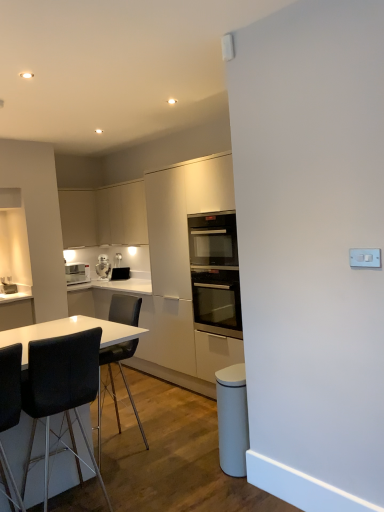
Question: From a real-world perspective, does black glass oven at center sit lower than black fabric chair at lower left, acting as the third chair starting from the front?

Choices:
 (A) yes
 (B) no

Answer: (B)

Question: Can you confirm if black glass oven at center is positioned to the right of black fabric chair at lower left, acting as the third chair starting from the front?

Choices:
 (A) no
 (B) yes

Answer: (B)

Question: Considering the relative positions of black glass oven at center and black fabric chair at lower left, acting as the third chair starting from the front, in the image provided, is black glass oven at center to the left of black fabric chair at lower left, acting as the third chair starting from the front, from the viewer's perspective?

Choices:
 (A) yes
 (B) no

Answer: (B)

Question: Is black glass oven at center completely or partially outside of black fabric chair at lower left, acting as the third chair starting from the front?

Choices:
 (A) no
 (B) yes

Answer: (B)

Question: Is black glass oven at center further to the viewer compared to black fabric chair at lower left, acting as the third chair starting from the front?

Choices:
 (A) yes
 (B) no

Answer: (A)

Question: Is black glass oven at center next to black fabric chair at lower left, acting as the third chair starting from the front, and touching it?

Choices:
 (A) yes
 (B) no

Answer: (B)

Question: Can we say black leather chair at lower left, arranged as the second chair when viewed from the back, lies outside white glossy microwave at upper left, which is counted as the 1th appliance, starting from the left?

Choices:
 (A) no
 (B) yes

Answer: (B)

Question: Are black leather chair at lower left, arranged as the second chair when viewed from the back, and white glossy microwave at upper left, which is counted as the 1th appliance, starting from the left, making contact?

Choices:
 (A) no
 (B) yes

Answer: (A)

Question: Is black leather chair at lower left, arranged as the second chair when viewed from the back, at the right side of white glossy microwave at upper left, the second appliance viewed from the right?

Choices:
 (A) no
 (B) yes

Answer: (B)

Question: From a real-world perspective, does black leather chair at lower left, which is the 2th chair from front to back, stand above white glossy microwave at upper left, which is counted as the 1th appliance, starting from the left?

Choices:
 (A) no
 (B) yes

Answer: (A)

Question: Is black leather chair at lower left, arranged as the second chair when viewed from the back, taller than white glossy microwave at upper left, the second appliance viewed from the right?

Choices:
 (A) no
 (B) yes

Answer: (B)

Question: Is black leather chair at lower left, arranged as the second chair when viewed from the back, bigger than white glossy microwave at upper left, the second appliance viewed from the right?

Choices:
 (A) no
 (B) yes

Answer: (B)

Question: From the image's perspective, is white glossy microwave at upper left, which is counted as the 1th appliance, starting from the left, over matte black toaster at center, the first appliance viewed from the right?

Choices:
 (A) yes
 (B) no

Answer: (A)